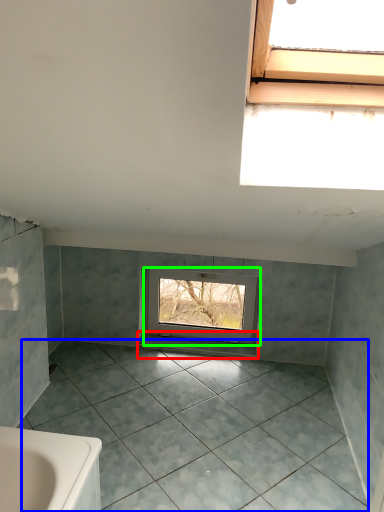
Question: Which is nearer to the window sill (highlighted by a red box)? ceramic tile (highlighted by a blue box) or window (highlighted by a green box).

Choices:
 (A) ceramic tile
 (B) window

Answer: (B)